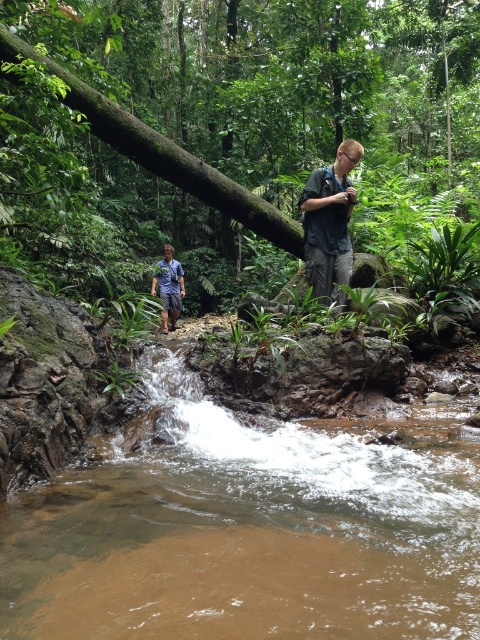
You are a park ranger planning to cross the stream. You notice the light brown fabric shirt at center and the camera. How far apart are these two items?

The light brown fabric shirt at center and the camera are 19.18 feet apart from each other.

You are standing at point (336, 198) and want to walk to point (437, 19). Is the path directly in front of you or behind you?

The path to point (437, 19) is behind you because point (437, 19) is located behind point (336, 198) according to the coordinates provided.

You are a hiker trying to locate the two people in the scene. According to the image, which person is positioned closer to you between the light brown fabric shirt at center and the blue shirt at center?

The light brown fabric shirt at center is closer to the viewer than the blue shirt at center, so the light brown fabric shirt at center is the one closer to you.